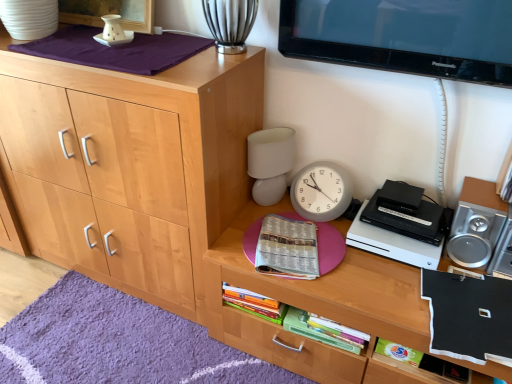
At what (x,y) coordinates should I click in order to perform the action: click on blank space to the left of black matte book at lower right, the 3th book from the left. Please return your answer as a coordinate pair (x, y). This screenshot has width=512, height=384. Looking at the image, I should click on (376, 293).